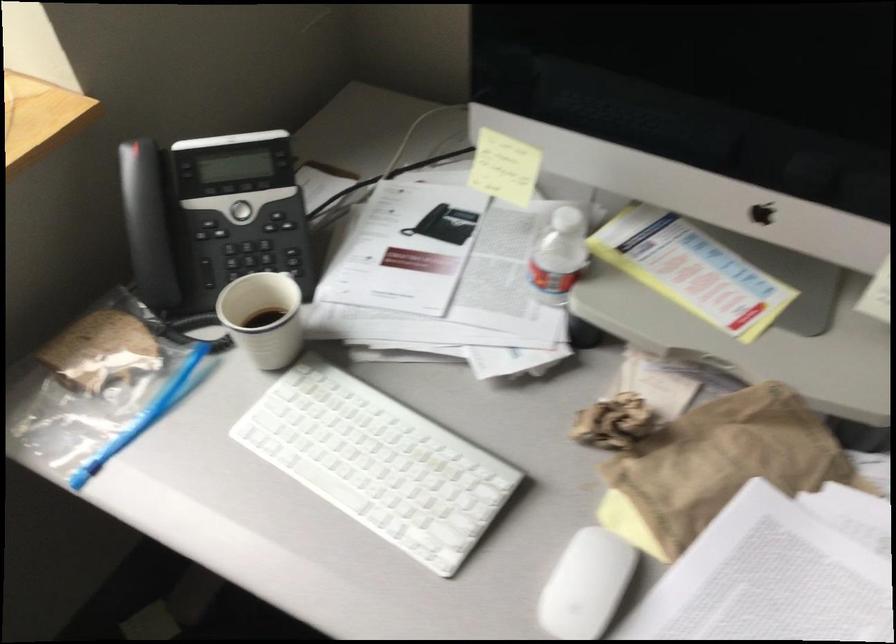
Find where to twist the white bottle cap. Please return your answer as a coordinate pair (x, y).

(565, 216)